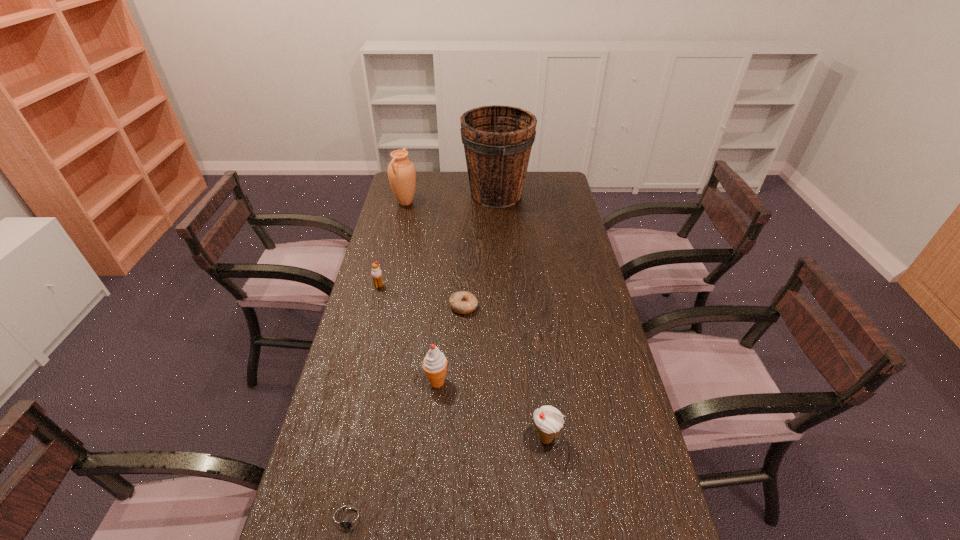
Locate an element on the screen. object at the far left corner is located at coordinates (401, 172).

In the image, there is a desktop. In order to click on vacant area at the far edge in this screenshot , I will do `click(469, 195)`.

Where is `vacant area at the left edge`? This screenshot has width=960, height=540. vacant area at the left edge is located at coordinates (385, 215).

Identify the location of vacant space at the right edge of the desktop. (567, 217).

The height and width of the screenshot is (540, 960). Find the location of `vacant point located between the second nearest icecream and the third farthest object`. vacant point located between the second nearest icecream and the third farthest object is located at coordinates (408, 334).

Identify the location of vacant space in between the shortest icecream and the second nearest icecream. Image resolution: width=960 pixels, height=540 pixels. (408, 334).

The height and width of the screenshot is (540, 960). Find the location of `empty space that is in between the shortest icecream and the second icecream from left to right`. empty space that is in between the shortest icecream and the second icecream from left to right is located at coordinates (408, 334).

The image size is (960, 540). Find the location of `free space between the fourth nearest object and the fifth tallest object`. free space between the fourth nearest object and the fifth tallest object is located at coordinates (421, 296).

Locate an element on the screen. The height and width of the screenshot is (540, 960). free space that is in between the tallest object and the rightmost icecream is located at coordinates (521, 316).

Where is `empty space between the second shortest object and the bucket`? Image resolution: width=960 pixels, height=540 pixels. empty space between the second shortest object and the bucket is located at coordinates (480, 251).